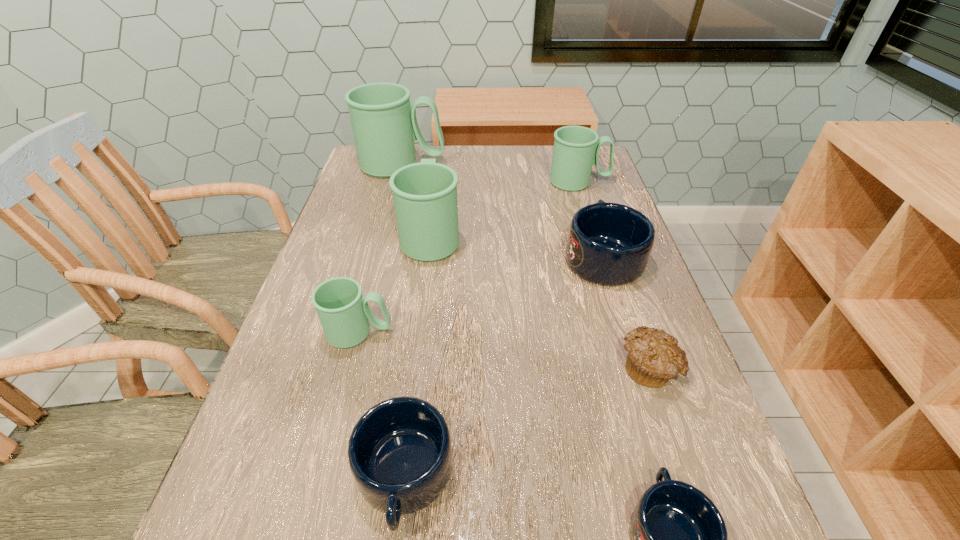
Identify the location of vacant space located on the side of the tallest mug with the handle. (557, 165).

In order to click on free spot located on the side of the sixth shortest mug with the handle in this screenshot , I will do `click(442, 159)`.

At what (x,y) coordinates should I click in order to perform the action: click on vacant space located on the side of the sixth shortest mug with the handle. Please return your answer as a coordinate pair (x, y). The height and width of the screenshot is (540, 960). Looking at the image, I should click on (442, 154).

Image resolution: width=960 pixels, height=540 pixels. Identify the location of vacant position located 0.360m on the side of the sixth shortest mug with the handle. (443, 148).

Identify the location of vacant area situated with the handle on the side of the farthest blue mug. The height and width of the screenshot is (540, 960). (587, 207).

This screenshot has height=540, width=960. Identify the location of vacant area situated 0.080m with the handle on the side of the farthest blue mug. (588, 211).

Find the location of `vacant space located with the handle on the side of the farthest blue mug`. vacant space located with the handle on the side of the farthest blue mug is located at coordinates (582, 190).

Find the location of `free spot located on the side of the nearest green mug with the handle`. free spot located on the side of the nearest green mug with the handle is located at coordinates (566, 332).

Image resolution: width=960 pixels, height=540 pixels. Find the location of `vacant area situated 0.230m on the left of the muffin`. vacant area situated 0.230m on the left of the muffin is located at coordinates (496, 368).

The height and width of the screenshot is (540, 960). Find the location of `muffin located in the right edge section of the desktop`. muffin located in the right edge section of the desktop is located at coordinates (654, 358).